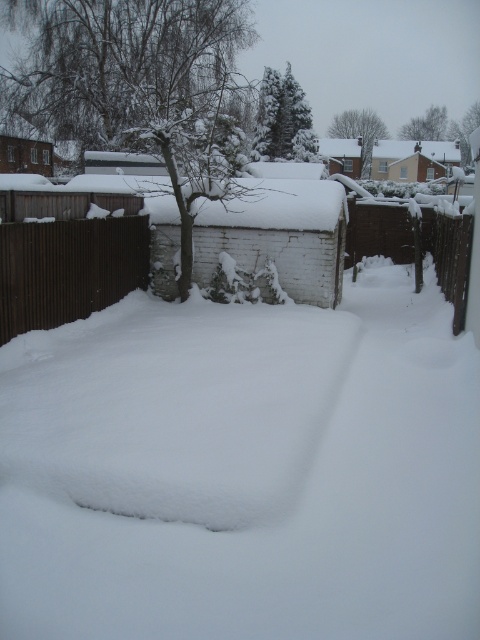
Between brown wooden fence at left and brown wooden fence at right, which one is positioned lower?

Positioned lower is brown wooden fence at left.

Between point (8, 305) and point (433, 224), which one is positioned behind?

The point (433, 224) is more distant.

Measure the distance between brown wooden fence at left and camera.

brown wooden fence at left is 7.26 meters from camera.

Find the location of a particular element. The width and height of the screenshot is (480, 640). brown wooden fence at left is located at coordinates (68, 269).

Which of these two, brown wooden fence at right or brick house at upper left, stands shorter?

brick house at upper left

Who is taller, brown wooden fence at right or brick house at upper left?

With more height is brown wooden fence at right.

You are a GUI agent. You are given a task and a screenshot of the screen. Output one action in this format:
    pyautogui.click(x=<x>, y=<y>)
    Task: Click on the brown wooden fence at right
    
    Given the screenshot: What is the action you would take?
    pyautogui.click(x=450, y=257)

Who is shorter, brown wooden fence at left or white brick house at upper center?

brown wooden fence at left

How far apart are brown wooden fence at left and white brick house at upper center?

brown wooden fence at left is 37.45 meters from white brick house at upper center.

Image resolution: width=480 pixels, height=640 pixels. Describe the element at coordinates (68, 269) in the screenshot. I see `brown wooden fence at left` at that location.

Where is `brown wooden fence at left`? The height and width of the screenshot is (640, 480). brown wooden fence at left is located at coordinates (68, 269).